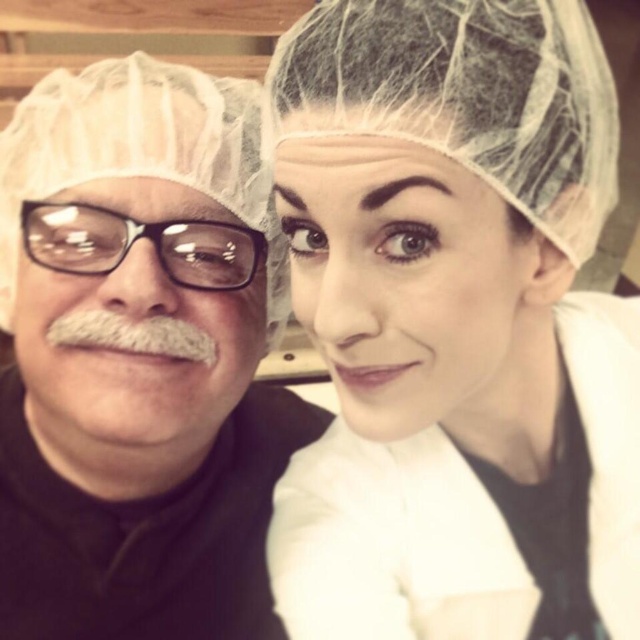
Question: Can you confirm if transparent plastic glasses at left is positioned to the right of white fuzzy mustache at left?

Choices:
 (A) yes
 (B) no

Answer: (A)

Question: Among these objects, which one is nearest to the camera?

Choices:
 (A) transparent plastic glasses at left
 (B) white fuzzy mustache at left
 (C) white mesh hairnet at upper center

Answer: (C)

Question: Which is farther from the white mesh hairnet at upper center?

Choices:
 (A) white fuzzy mustache at left
 (B) matte black hair at left

Answer: (A)

Question: Is matte black hair at left closer to camera compared to white fuzzy mustache at left?

Choices:
 (A) no
 (B) yes

Answer: (B)

Question: Does white mesh hairnet at upper center have a greater width compared to matte black hair at left?

Choices:
 (A) yes
 (B) no

Answer: (A)

Question: Which of the following is the farthest from the observer?

Choices:
 (A) matte black hair at left
 (B) transparent plastic glasses at left

Answer: (B)